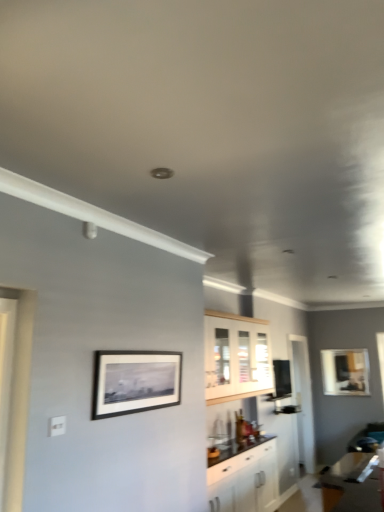
Question: Is white glossy cabinet at center, the 1th cabinetry from the bottom, closer to the viewer compared to matte black picture frame at upper right, the 2th picture frame viewed from the top?

Choices:
 (A) yes
 (B) no

Answer: (A)

Question: Can you confirm if white glossy cabinet at center, acting as the second cabinetry starting from the top, is wider than matte black picture frame at upper right, acting as the first picture frame starting from the back?

Choices:
 (A) no
 (B) yes

Answer: (B)

Question: Is the surface of white glossy cabinet at center, the 1th cabinetry from the bottom, in direct contact with matte black picture frame at upper right, acting as the first picture frame starting from the back?

Choices:
 (A) yes
 (B) no

Answer: (B)

Question: From the image's perspective, is white glossy cabinet at center, the 1th cabinetry from the bottom, located above matte black picture frame at upper right, the 2th picture frame viewed from the top?

Choices:
 (A) no
 (B) yes

Answer: (A)

Question: Considering the relative sizes of white glossy cabinet at center, the 1th cabinetry from the bottom, and matte black picture frame at upper right, which appears as the 1th picture frame when viewed from the right, in the image provided, is white glossy cabinet at center, the 1th cabinetry from the bottom, bigger than matte black picture frame at upper right, which appears as the 1th picture frame when viewed from the right,?

Choices:
 (A) yes
 (B) no

Answer: (A)

Question: Can you confirm if white glossy cabinet at center, acting as the second cabinetry starting from the top, is positioned to the left of matte black picture frame at upper right, the 2th picture frame viewed from the front?

Choices:
 (A) yes
 (B) no

Answer: (A)

Question: Is white wood cabinet at center, positioned as the 2th cabinetry in bottom-to-top order, in front of white glossy cabinet at center, acting as the second cabinetry starting from the top?

Choices:
 (A) yes
 (B) no

Answer: (B)

Question: Is white glossy cabinet at center, acting as the second cabinetry starting from the top, at the back of white wood cabinet at center, positioned as the 2th cabinetry in bottom-to-top order?

Choices:
 (A) no
 (B) yes

Answer: (A)

Question: Is white wood cabinet at center, positioned as the 2th cabinetry in bottom-to-top order, oriented towards white glossy cabinet at center, acting as the second cabinetry starting from the top?

Choices:
 (A) no
 (B) yes

Answer: (A)

Question: From the image's perspective, does white wood cabinet at center, positioned as the 1th cabinetry in top-to-bottom order, appear lower than white glossy cabinet at center, the 1th cabinetry from the bottom?

Choices:
 (A) no
 (B) yes

Answer: (A)

Question: Can you confirm if white wood cabinet at center, positioned as the 2th cabinetry in bottom-to-top order, is shorter than white glossy cabinet at center, the 1th cabinetry from the bottom?

Choices:
 (A) no
 (B) yes

Answer: (B)

Question: Considering the relative sizes of white wood cabinet at center, positioned as the 1th cabinetry in top-to-bottom order, and white glossy cabinet at center, acting as the second cabinetry starting from the top, in the image provided, is white wood cabinet at center, positioned as the 1th cabinetry in top-to-bottom order, thinner than white glossy cabinet at center, acting as the second cabinetry starting from the top,?

Choices:
 (A) yes
 (B) no

Answer: (A)

Question: Is transparent glass door at center positioned behind matte black picture frame at upper right, acting as the first picture frame starting from the back?

Choices:
 (A) yes
 (B) no

Answer: (B)